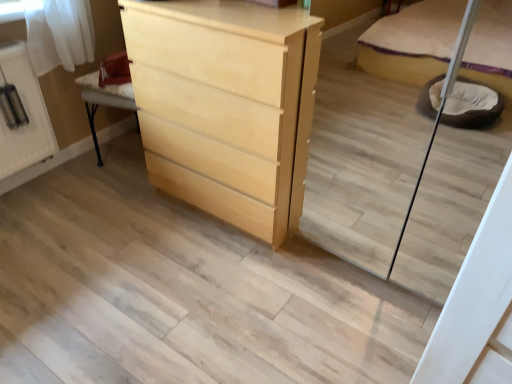
The height and width of the screenshot is (384, 512). Identify the location of light wood/finish chest of drawers at center. pyautogui.click(x=226, y=106).

Describe the element at coordinates (226, 106) in the screenshot. I see `light wood/finish chest of drawers at center` at that location.

What do you see at coordinates (22, 113) in the screenshot? Image resolution: width=512 pixels, height=384 pixels. I see `white glossy cabinet at upper left` at bounding box center [22, 113].

Image resolution: width=512 pixels, height=384 pixels. What are the coordinates of `white glossy cabinet at upper left` in the screenshot? It's located at (22, 113).

Image resolution: width=512 pixels, height=384 pixels. In order to click on light wood/finish chest of drawers at center in this screenshot , I will do `click(226, 106)`.

Which is more to the left, white glossy cabinet at upper left or light wood/finish chest of drawers at center?

From the viewer's perspective, white glossy cabinet at upper left appears more on the left side.

Between white glossy cabinet at upper left and light wood/finish chest of drawers at center, which one is positioned behind?

white glossy cabinet at upper left is further away from the camera.

Considering the positions of points (4, 60) and (311, 27), is point (4, 60) farther from camera compared to point (311, 27)?

Yes.

From the image's perspective, would you say white glossy cabinet at upper left is shown under light wood/finish chest of drawers at center?

Actually, white glossy cabinet at upper left appears above light wood/finish chest of drawers at center in the image.

From the picture: From a real-world perspective, is white glossy cabinet at upper left on light wood/finish chest of drawers at center?

No, from a real-world perspective, white glossy cabinet at upper left is not above light wood/finish chest of drawers at center.

Considering the relative sizes of white glossy cabinet at upper left and light wood/finish chest of drawers at center in the image provided, is white glossy cabinet at upper left thinner than light wood/finish chest of drawers at center?

Yes.

Is white glossy cabinet at upper left taller or shorter than light wood/finish chest of drawers at center?

white glossy cabinet at upper left is shorter than light wood/finish chest of drawers at center.

Is white glossy cabinet at upper left bigger or smaller than light wood/finish chest of drawers at center?

In the image, white glossy cabinet at upper left appears to be smaller than light wood/finish chest of drawers at center.

Is white glossy cabinet at upper left situated inside light wood/finish chest of drawers at center or outside?

white glossy cabinet at upper left is not inside light wood/finish chest of drawers at center, it's outside.

Is white glossy cabinet at upper left not near light wood/finish chest of drawers at center?

That's not correct — white glossy cabinet at upper left is a little close to light wood/finish chest of drawers at center.

Is white glossy cabinet at upper left oriented away from light wood/finish chest of drawers at center?

white glossy cabinet at upper left does not have its back to light wood/finish chest of drawers at center.

How different are the orientations of white glossy cabinet at upper left and light wood/finish chest of drawers at center in degrees?

The facing directions of white glossy cabinet at upper left and light wood/finish chest of drawers at center are 90.1 degrees apart.

Could you measure the distance between white glossy cabinet at upper left and light wood/finish chest of drawers at center?

white glossy cabinet at upper left is 36.41 inches away from light wood/finish chest of drawers at center.

Locate an element on the screen. cabinetry behind the light wood/finish chest of drawers at center is located at coordinates (22, 113).

Which object is positioned more to the left, light wood/finish chest of drawers at center or white glossy cabinet at upper left?

white glossy cabinet at upper left is more to the left.

Relative to white glossy cabinet at upper left, is light wood/finish chest of drawers at center in front or behind?

Clearly, light wood/finish chest of drawers at center is in front of white glossy cabinet at upper left.

Which is less distant, (276,237) or (6,114)?

Point (276,237) is positioned closer to the camera compared to point (6,114).

From the image's perspective, is light wood/finish chest of drawers at center positioned above or below white glossy cabinet at upper left?

Clearly, from the image's perspective, light wood/finish chest of drawers at center is below white glossy cabinet at upper left.

From a real-world perspective, is light wood/finish chest of drawers at center below white glossy cabinet at upper left?

Actually, light wood/finish chest of drawers at center is physically above white glossy cabinet at upper left in the real world.

Between light wood/finish chest of drawers at center and white glossy cabinet at upper left, which one has larger width?

Wider between the two is light wood/finish chest of drawers at center.

Is light wood/finish chest of drawers at center taller or shorter than white glossy cabinet at upper left?

Clearly, light wood/finish chest of drawers at center is taller compared to white glossy cabinet at upper left.

Considering the relative sizes of light wood/finish chest of drawers at center and white glossy cabinet at upper left in the image provided, is light wood/finish chest of drawers at center smaller than white glossy cabinet at upper left?

Actually, light wood/finish chest of drawers at center might be larger than white glossy cabinet at upper left.

Is light wood/finish chest of drawers at center completely or partially outside of white glossy cabinet at upper left?

Yes, light wood/finish chest of drawers at center is outside of white glossy cabinet at upper left.

In the scene shown: Is there a large distance between light wood/finish chest of drawers at center and white glossy cabinet at upper left?

They are positioned close to each other.

Is light wood/finish chest of drawers at center looking in the opposite direction of white glossy cabinet at upper left?

No, light wood/finish chest of drawers at center is not facing away from white glossy cabinet at upper left.

What's the angular difference between light wood/finish chest of drawers at center and white glossy cabinet at upper left's facing directions?

The angle between the facing direction of light wood/finish chest of drawers at center and the facing direction of white glossy cabinet at upper left is 90.1 degrees.

Could you measure the distance between light wood/finish chest of drawers at center and white glossy cabinet at upper left?

36.41 inches.

You are a GUI agent. You are given a task and a screenshot of the screen. Output one action in this format:
    pyautogui.click(x=<x>, y=<y>)
    Task: Click on the chest of drawers below the white glossy cabinet at upper left (from the image's perspective)
    The image size is (512, 384).
    Given the screenshot: What is the action you would take?
    pyautogui.click(x=226, y=106)

In order to click on chest of drawers on the right side of white glossy cabinet at upper left in this screenshot , I will do `click(226, 106)`.

Find the location of a particular element. The image size is (512, 384). chest of drawers below the white glossy cabinet at upper left (from the image's perspective) is located at coordinates (226, 106).